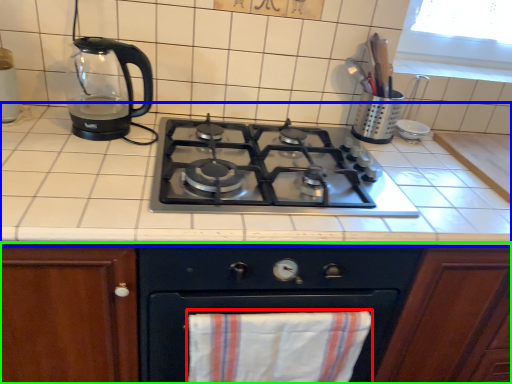
Question: Which object is the closest to the beach towel (highlighted by a red box)? Choose among these: countertop (highlighted by a blue box) or cabinetry (highlighted by a green box).

Choices:
 (A) countertop
 (B) cabinetry

Answer: (B)